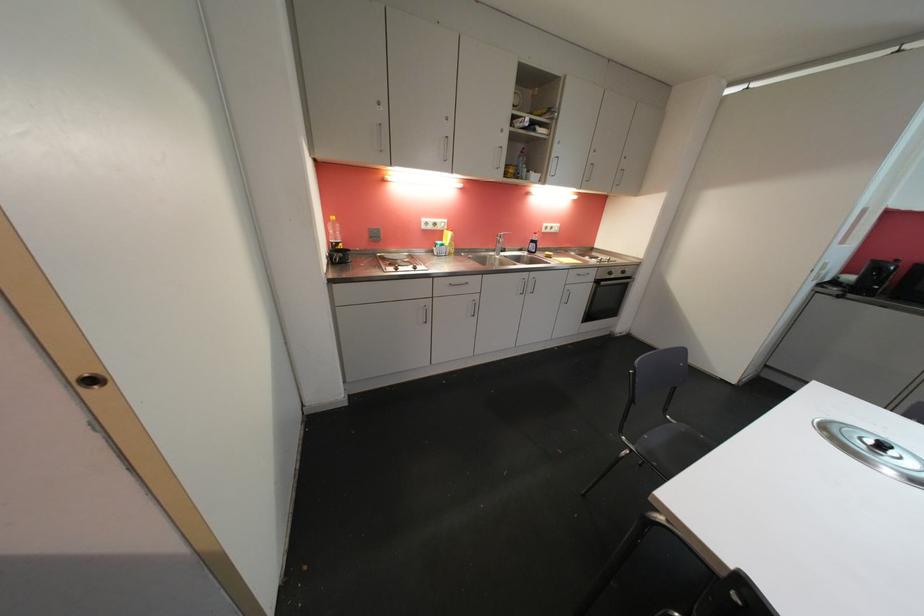
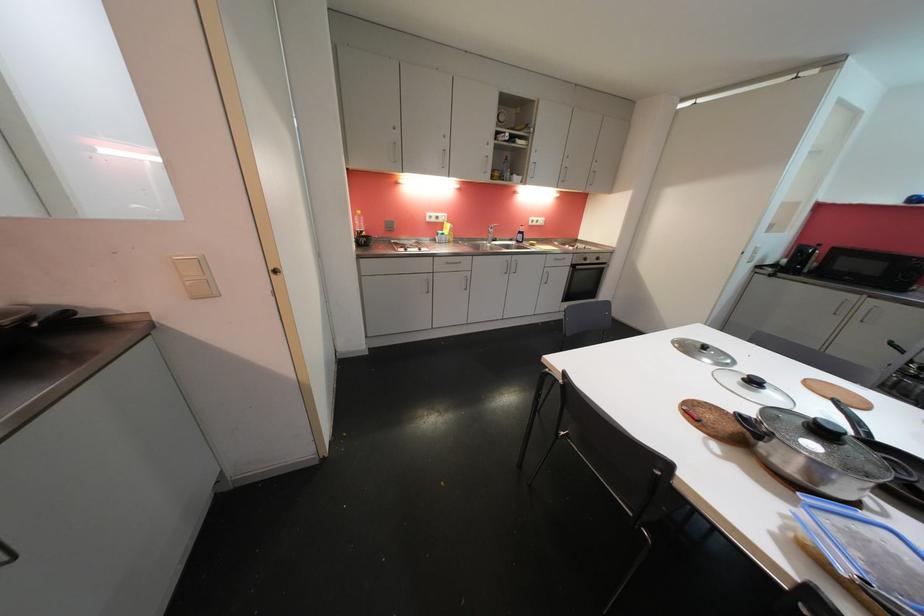
Locate, in the second image, the point that corresponds to (614,276) in the first image.

(590, 262)